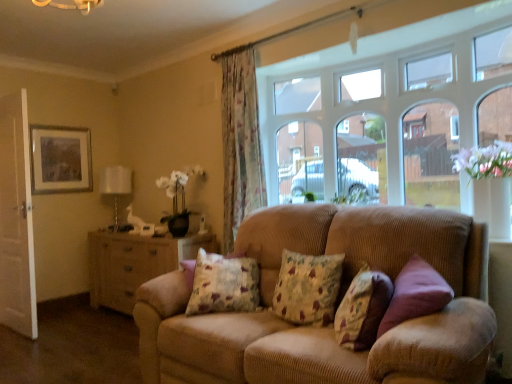
Question: From the image's perspective, does corduroy couch at center appear lower than floral fabric curtain at center?

Choices:
 (A) no
 (B) yes

Answer: (B)

Question: Is corduroy couch at center facing towards floral fabric curtain at center?

Choices:
 (A) no
 (B) yes

Answer: (A)

Question: Is floral fabric curtain at center at the back of corduroy couch at center?

Choices:
 (A) no
 (B) yes

Answer: (A)

Question: Can you confirm if corduroy couch at center is taller than floral fabric curtain at center?

Choices:
 (A) no
 (B) yes

Answer: (A)

Question: Considering the relative sizes of corduroy couch at center and floral fabric curtain at center in the image provided, is corduroy couch at center smaller than floral fabric curtain at center?

Choices:
 (A) no
 (B) yes

Answer: (A)

Question: From the image's perspective, is floral fabric cushion at center, marked as the 2th pillow in a right-to-left arrangement, located above or below white fabric lampshade at left?

Choices:
 (A) below
 (B) above

Answer: (A)

Question: In terms of height, does floral fabric cushion at center, marked as the 2th pillow in a right-to-left arrangement, look taller or shorter compared to white fabric lampshade at left?

Choices:
 (A) short
 (B) tall

Answer: (A)

Question: Considering the relative positions of floral fabric cushion at center, marked as the 2th pillow in a right-to-left arrangement, and white fabric lampshade at left in the image provided, is floral fabric cushion at center, marked as the 2th pillow in a right-to-left arrangement, to the left or to the right of white fabric lampshade at left?

Choices:
 (A) right
 (B) left

Answer: (A)

Question: From a real-world perspective, is floral fabric cushion at center, marked as the 2th pillow in a right-to-left arrangement, positioned above or below white fabric lampshade at left?

Choices:
 (A) above
 (B) below

Answer: (B)

Question: Which is correct: green leafy plant at upper center is inside floral fabric cushion at center, marked as the 2th pillow in a right-to-left arrangement, or outside of it?

Choices:
 (A) outside
 (B) inside

Answer: (A)

Question: Considering the relative positions of green leafy plant at upper center and floral fabric cushion at center, marked as the 2th pillow in a right-to-left arrangement, in the image provided, is green leafy plant at upper center to the left or to the right of floral fabric cushion at center, marked as the 2th pillow in a right-to-left arrangement,?

Choices:
 (A) left
 (B) right

Answer: (B)

Question: In terms of height, does green leafy plant at upper center look taller or shorter compared to floral fabric cushion at center, acting as the second pillow starting from the left?

Choices:
 (A) tall
 (B) short

Answer: (B)

Question: From the image's perspective, relative to floral fabric cushion at center, acting as the second pillow starting from the left, is green leafy plant at upper center above or below?

Choices:
 (A) below
 (B) above

Answer: (B)

Question: Is point (244, 268) positioned closer to the camera than point (416, 379)?

Choices:
 (A) farther
 (B) closer

Answer: (A)

Question: Would you say floral fabric cushion at center, the third pillow positioned from the right, is to the left or to the right of corduroy couch at center in the picture?

Choices:
 (A) left
 (B) right

Answer: (A)